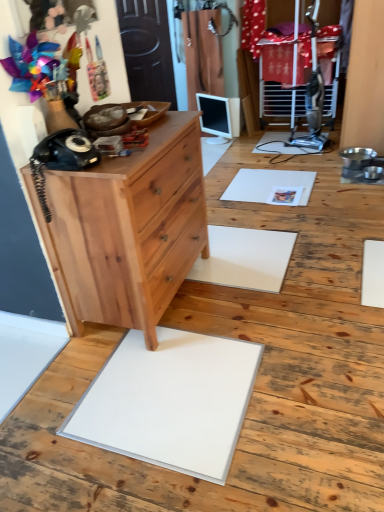
Question: Can you confirm if black matte rotary phone at left is taller than natural wood dresser at left?

Choices:
 (A) yes
 (B) no

Answer: (A)

Question: Considering the relative sizes of black matte rotary phone at left and natural wood dresser at left in the image provided, is black matte rotary phone at left smaller than natural wood dresser at left?

Choices:
 (A) yes
 (B) no

Answer: (A)

Question: From a real-world perspective, is black matte rotary phone at left positioned over natural wood dresser at left based on gravity?

Choices:
 (A) no
 (B) yes

Answer: (B)

Question: From a real-world perspective, is black matte rotary phone at left under natural wood dresser at left?

Choices:
 (A) no
 (B) yes

Answer: (A)

Question: From the image's perspective, is black matte rotary phone at left over natural wood dresser at left?

Choices:
 (A) no
 (B) yes

Answer: (A)

Question: From a real-world perspective, relative to natural wood chest of drawers at left, is natural wood dresser at left vertically above or below?

Choices:
 (A) above
 (B) below

Answer: (B)

Question: Is natural wood dresser at left inside the boundaries of natural wood chest of drawers at left, or outside?

Choices:
 (A) inside
 (B) outside

Answer: (B)

Question: Considering the positions of natural wood dresser at left and natural wood chest of drawers at left in the image, is natural wood dresser at left taller or shorter than natural wood chest of drawers at left?

Choices:
 (A) tall
 (B) short

Answer: (B)

Question: In terms of size, does natural wood dresser at left appear bigger or smaller than natural wood chest of drawers at left?

Choices:
 (A) small
 (B) big

Answer: (B)

Question: Is point (97, 218) positioned closer to the camera than point (43, 468)?

Choices:
 (A) closer
 (B) farther

Answer: (B)

Question: From a real-world perspective, relative to natural wood dresser at left, is natural wood chest of drawers at left vertically above or below?

Choices:
 (A) above
 (B) below

Answer: (A)

Question: Based on their sizes in the image, would you say natural wood chest of drawers at left is bigger or smaller than natural wood dresser at left?

Choices:
 (A) small
 (B) big

Answer: (A)

Question: From the image's perspective, is natural wood chest of drawers at left positioned above or below natural wood dresser at left?

Choices:
 (A) below
 (B) above

Answer: (A)

Question: Is black matte rotary phone at left in front of or behind natural wood dresser at left in the image?

Choices:
 (A) front
 (B) behind

Answer: (A)

Question: From a real-world perspective, is black matte rotary phone at left above or below natural wood dresser at left?

Choices:
 (A) above
 (B) below

Answer: (A)